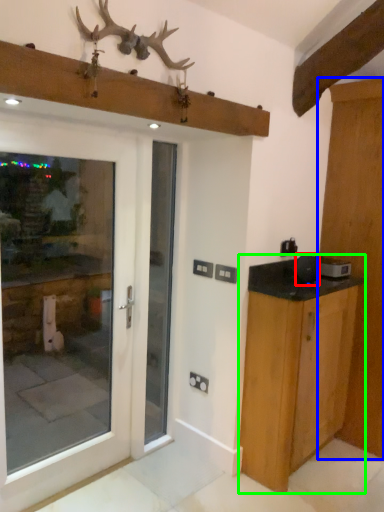
Question: Which object is the closest to the appliance (highlighted by a red box)? Choose among these: door (highlighted by a blue box) or cabinetry (highlighted by a green box).

Choices:
 (A) door
 (B) cabinetry

Answer: (B)